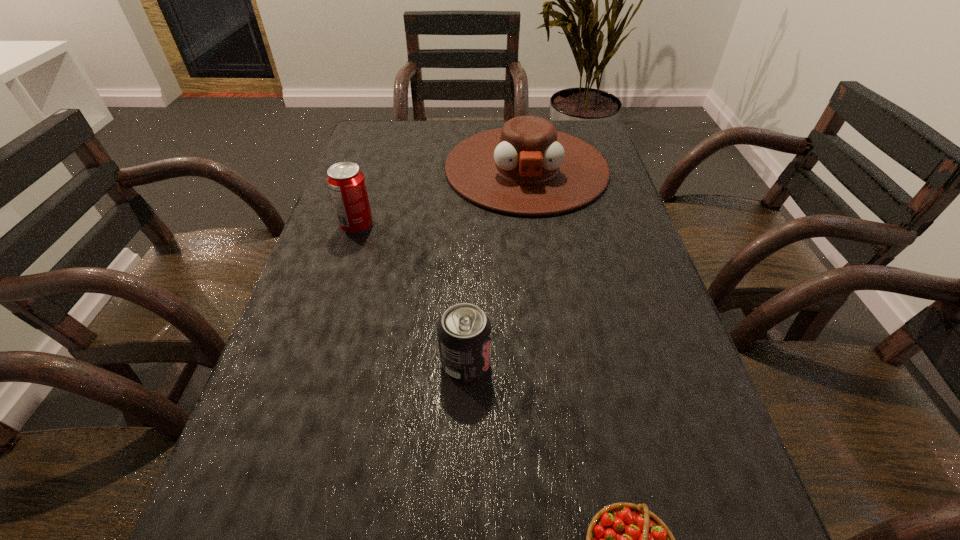
At what (x,y) coordinates should I click in order to perform the action: click on object that is the third closest to the leftmost object. Please return your answer as a coordinate pair (x, y). Looking at the image, I should click on tap(623, 539).

Select which object appears as the second closest to the shorter soda can. Please provide its 2D coordinates. Your answer should be formatted as a tuple, i.e. [(x, y)], where the tuple contains the x and y coordinates of a point satisfying the conditions above.

[(346, 183)]

Identify the location of free location that satisfies the following two spatial constraints: 1. on the front side of the shorter soda can; 2. on the left side of the farther soda can. This screenshot has width=960, height=540. (314, 362).